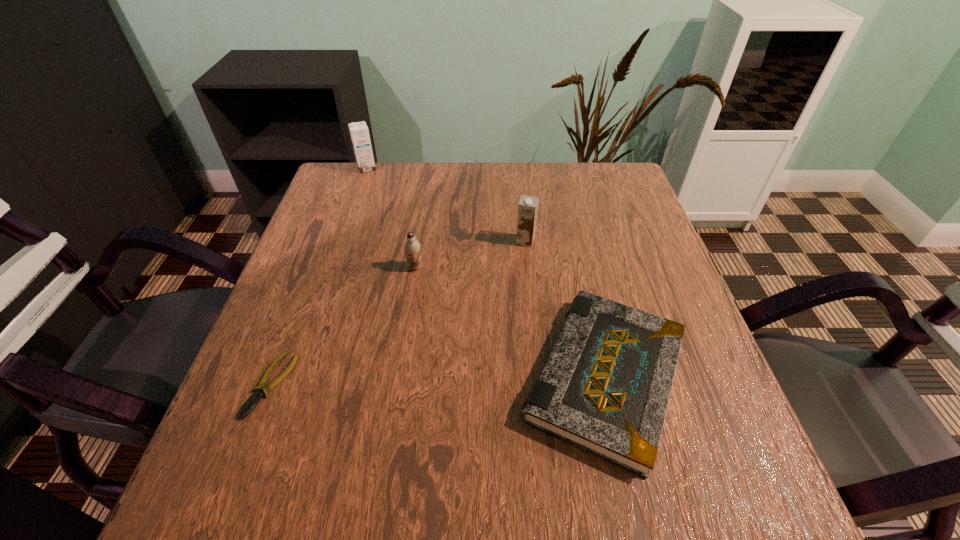
You are a GUI agent. You are given a task and a screenshot of the screen. Output one action in this format:
    pyautogui.click(x=<x>, y=<y>)
    Task: Click on the free space between the third object from left to right and the leftmost chocolate milk
    
    Given the screenshot: What is the action you would take?
    pyautogui.click(x=391, y=218)

Image resolution: width=960 pixels, height=540 pixels. Identify the location of empty space that is in between the fourth tallest object and the rightmost chocolate milk. (565, 309).

You are a GUI agent. You are given a task and a screenshot of the screen. Output one action in this format:
    pyautogui.click(x=<x>, y=<y>)
    Task: Click on the vacant space that is in between the second shortest object and the farthest object
    The height and width of the screenshot is (540, 960).
    Given the screenshot: What is the action you would take?
    pyautogui.click(x=486, y=273)

Find the location of a particular element. This screenshot has width=960, height=540. blank region between the fourth nearest object and the pliers is located at coordinates (398, 313).

The height and width of the screenshot is (540, 960). What are the coordinates of `empty space that is in between the third farthest object and the shortest object` in the screenshot? It's located at [x=343, y=326].

Identify the location of blank region between the shortest chocolate milk and the pliers. (343, 326).

The height and width of the screenshot is (540, 960). I want to click on free area in between the second nearest chocolate milk and the shortest object, so click(398, 313).

Identify which object is the nearest to the pliers. Please provide its 2D coordinates. Your answer should be formatted as a tuple, i.e. [(x, y)], where the tuple contains the x and y coordinates of a point satisfying the conditions above.

[(412, 247)]

You are a GUI agent. You are given a task and a screenshot of the screen. Output one action in this format:
    pyautogui.click(x=<x>, y=<y>)
    Task: Click on the object identified as the fourth closest to the notebook
    This screenshot has height=540, width=960.
    Given the screenshot: What is the action you would take?
    pyautogui.click(x=359, y=132)

Locate an element on the screen. The height and width of the screenshot is (540, 960). chocolate milk that can be found as the closest to the fourth tallest object is located at coordinates (528, 206).